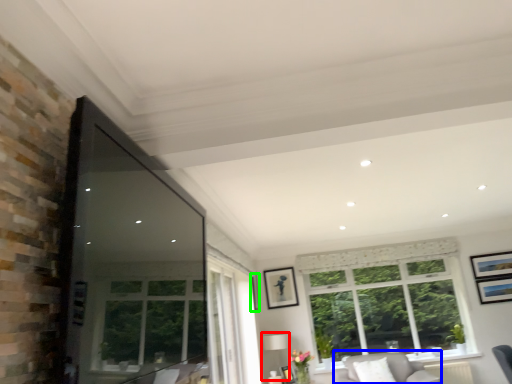
Question: Based on their relative distances, which object is nearer to lamp (highlighted by a red box)? Choose from couch (highlighted by a blue box) and picture frame (highlighted by a green box).

Choices:
 (A) couch
 (B) picture frame

Answer: (B)